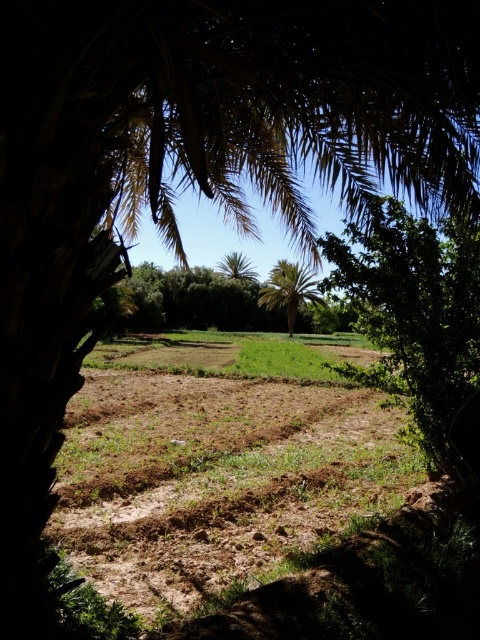
Question: Does brown soil at center have a lesser width compared to green leafy tree at center?

Choices:
 (A) yes
 (B) no

Answer: (B)

Question: Observing the image, what is the correct spatial positioning of green leafy palm at center in reference to green leafy palm tree at center?

Choices:
 (A) above
 (B) below

Answer: (B)

Question: Which of the following is the closest to the observer?

Choices:
 (A) (420, 394)
 (B) (229, 269)
 (C) (280, 262)
 (D) (108, 424)

Answer: (A)

Question: Which point is farther to the camera?

Choices:
 (A) (396, 305)
 (B) (233, 342)
 (C) (238, 269)

Answer: (C)

Question: Does brown soil at center appear over green leafy palm tree at center?

Choices:
 (A) no
 (B) yes

Answer: (A)

Question: Among these points, which one is farthest from the camera?

Choices:
 (A) (291, 324)
 (B) (112, 522)
 (C) (243, 280)

Answer: (C)